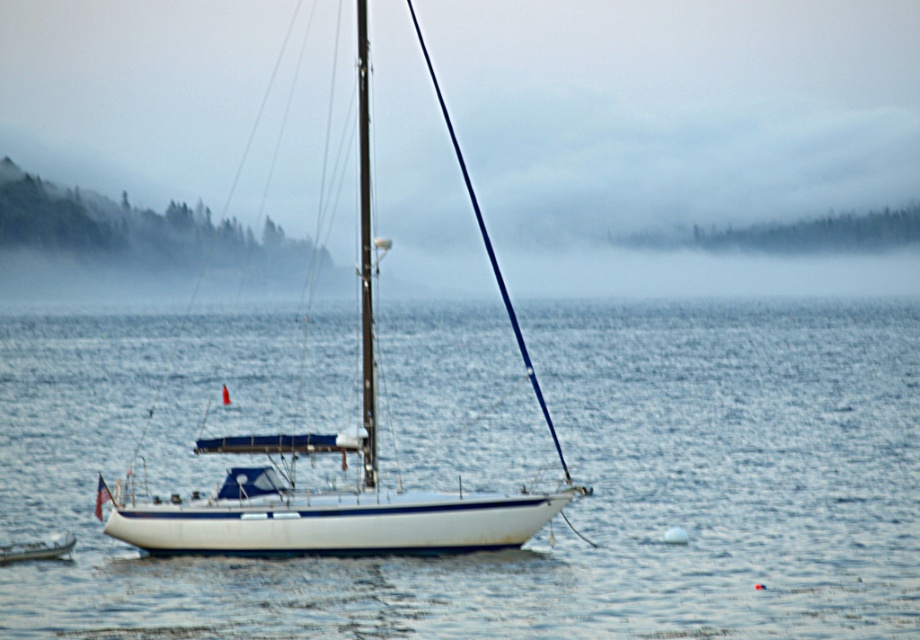
Question: Which object is closer to the camera taking this photo?

Choices:
 (A) white smooth water at center
 (B) white glossy sailboat at center

Answer: (A)

Question: Is white smooth water at center positioned at the back of white glossy boat at lower left?

Choices:
 (A) no
 (B) yes

Answer: (A)

Question: Does white glossy sailboat at center appear over white glossy boat at lower left?

Choices:
 (A) yes
 (B) no

Answer: (A)

Question: Is white smooth water at center below white glossy boat at lower left?

Choices:
 (A) yes
 (B) no

Answer: (B)

Question: Which of the following is the farthest from the observer?

Choices:
 (A) (797, 410)
 (B) (52, 550)

Answer: (A)

Question: Which point appears farthest from the camera in this image?

Choices:
 (A) (493, 276)
 (B) (391, 564)
 (C) (60, 547)

Answer: (A)